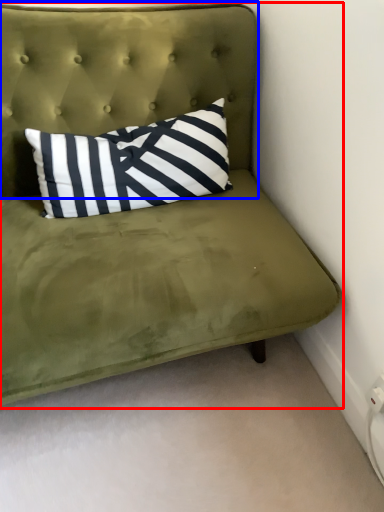
Question: Which object appears farthest to the camera in this image, studio couch (highlighted by a red box) or headboard (highlighted by a blue box)?

Choices:
 (A) studio couch
 (B) headboard

Answer: (B)